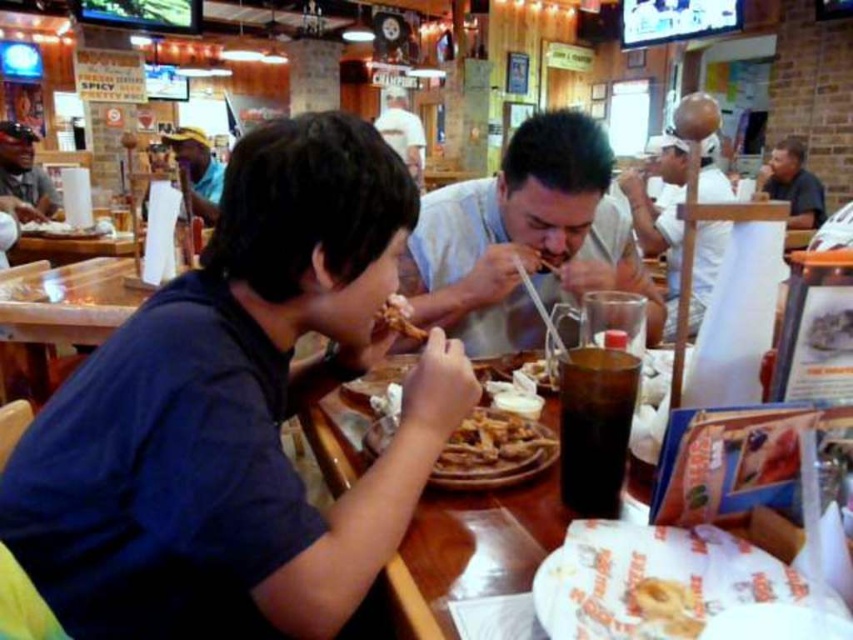
Who is taller, white paper hat at upper center or golden crispy donut at center?

white paper hat at upper center

Is white paper hat at upper center wider than golden crispy donut at center?

Yes, white paper hat at upper center is wider than golden crispy donut at center.

Does point (387, 125) come farther from viewer compared to point (685, 612)?

That is True.

Where is `white paper hat at upper center`? This screenshot has height=640, width=853. white paper hat at upper center is located at coordinates (402, 131).

Does white matte bowl at upper center have a lesser height compared to dark gray shirt at upper right?

No.

Is white matte bowl at upper center to the left of dark gray shirt at upper right from the viewer's perspective?

Yes, white matte bowl at upper center is to the left of dark gray shirt at upper right.

The width and height of the screenshot is (853, 640). I want to click on white matte bowl at upper center, so click(695, 150).

Is dark blue shirt at left taller than white matte bowl at upper center?

No.

Who is taller, dark blue shirt at left or white matte bowl at upper center?

white matte bowl at upper center is taller.

Find the location of `dark blue shirt at left`. dark blue shirt at left is located at coordinates (236, 413).

At what (x,y) coordinates should I click in order to perform the action: click on dark blue shirt at left. Please return your answer as a coordinate pair (x, y). The height and width of the screenshot is (640, 853). Looking at the image, I should click on (236, 413).